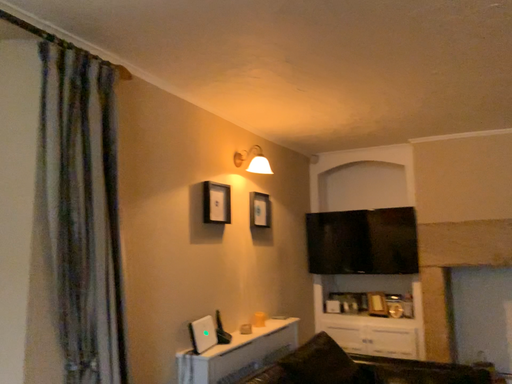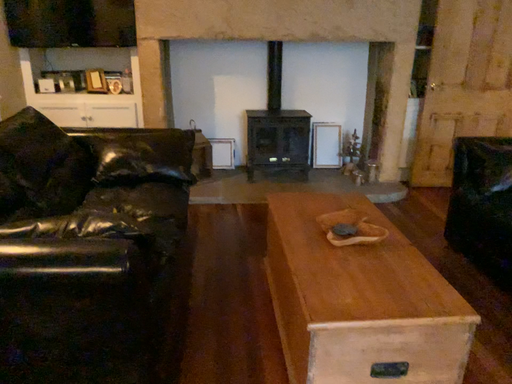
Question: How did the camera likely rotate when shooting the video?

Choices:
 (A) rotated upward
 (B) rotated downward

Answer: (B)